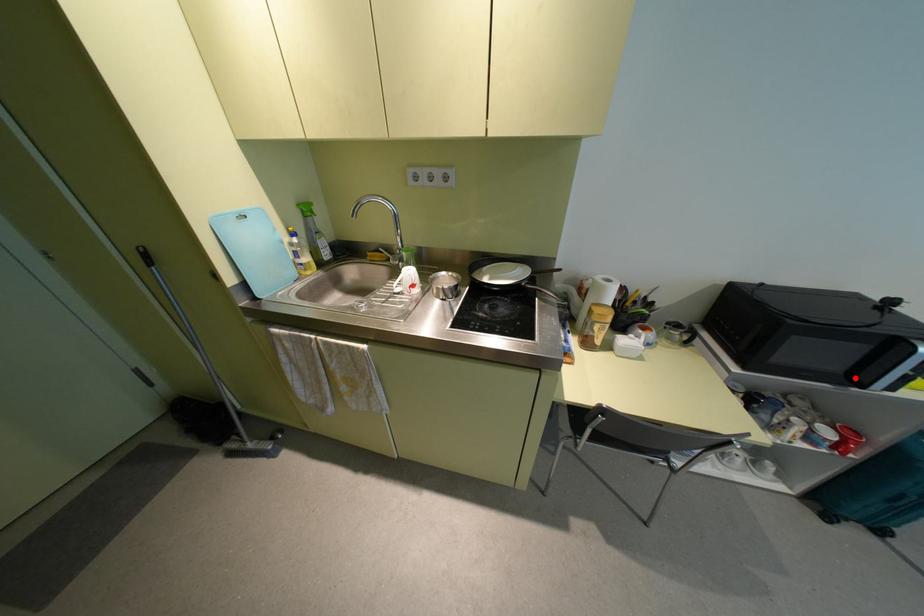
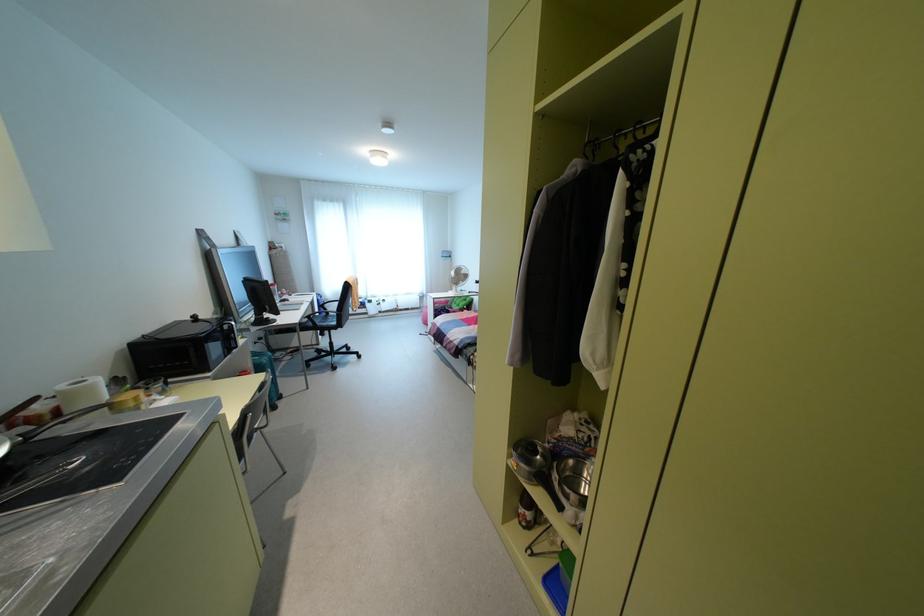
Question: I am providing you with two images of the same scene from different viewpoints. In image1, a red point is highlighted. Considering the same 3D point in image2, which of the following is correct?

Choices:
 (A) It is closer
 (B) It is farther

Answer: (A)